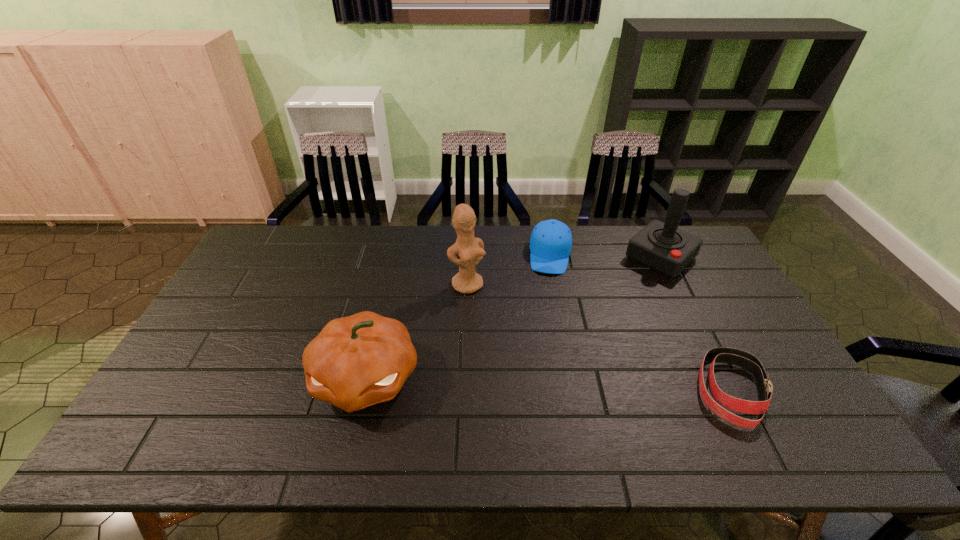
The height and width of the screenshot is (540, 960). Find the location of `dog collar that is positioned at the near edge`. dog collar that is positioned at the near edge is located at coordinates (743, 359).

The image size is (960, 540). Identify the location of dog collar that is at the right edge. (743, 359).

The height and width of the screenshot is (540, 960). I want to click on joystick present at the right edge, so click(662, 247).

Image resolution: width=960 pixels, height=540 pixels. Identify the location of object at the far right corner. (662, 247).

This screenshot has width=960, height=540. Identify the location of object positioned at the near right corner. (743, 359).

You are a GUI agent. You are given a task and a screenshot of the screen. Output one action in this format:
    pyautogui.click(x=<x>, y=<y>)
    Task: Click on the vacant position at the far edge of the desktop
    The image size is (960, 540).
    Given the screenshot: What is the action you would take?
    pyautogui.click(x=425, y=233)

I want to click on vacant region at the near edge of the desktop, so click(643, 416).

In the image, there is a desktop. Where is `vacant space at the left edge`? vacant space at the left edge is located at coordinates (214, 340).

Locate an element on the screen. Image resolution: width=960 pixels, height=540 pixels. vacant space at the right edge of the desktop is located at coordinates (713, 345).

In the image, there is a desktop. Identify the location of vacant space at the far left corner. (252, 258).